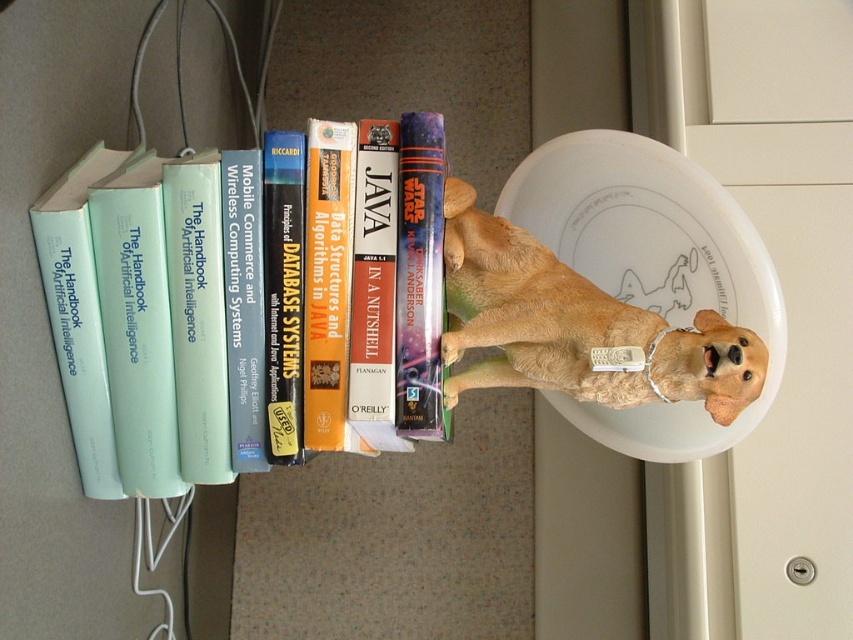
Question: Can you confirm if light blue paperback book at left is thinner than golden fur dog at center?

Choices:
 (A) yes
 (B) no

Answer: (B)

Question: Among these objects, which one is farthest from the camera?

Choices:
 (A) light blue paperback book at left
 (B) golden fur dog at center
 (C) hardcover book at center

Answer: (C)

Question: Which point appears closest to the camera in this image?

Choices:
 (A) (444, 156)
 (B) (561, 385)
 (C) (126, 156)

Answer: (B)

Question: Considering the relative positions of light blue paperback book at left and hardcover book at center in the image provided, where is light blue paperback book at left located with respect to hardcover book at center?

Choices:
 (A) right
 (B) left

Answer: (B)

Question: Among these objects, which one is farthest from the camera?

Choices:
 (A) light blue paperback book at left
 (B) hardcover book at center

Answer: (B)

Question: Does light blue paperback book at left lie behind hardcover book at center?

Choices:
 (A) no
 (B) yes

Answer: (A)